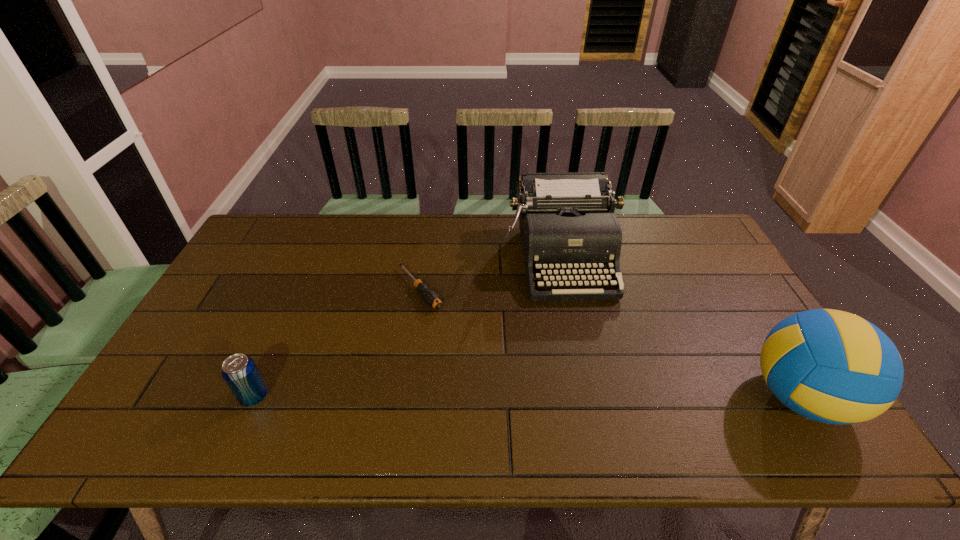
The height and width of the screenshot is (540, 960). In order to click on free point located at the tip of the second object from left to right in this screenshot , I will do `click(473, 353)`.

At what (x,y) coordinates should I click in order to perform the action: click on free space located 0.330m at the tip of the second object from left to right. Please return your answer as a coordinate pair (x, y). Looking at the image, I should click on (501, 384).

Locate an element on the screen. The width and height of the screenshot is (960, 540). vacant space located 0.190m on the front-facing side of the typewriter is located at coordinates (586, 355).

Find the location of a particular element. free space located on the front-facing side of the typewriter is located at coordinates (577, 324).

Find the location of a particular element. The height and width of the screenshot is (540, 960). free space located 0.110m on the front-facing side of the typewriter is located at coordinates (580, 332).

Where is `object that is at the far edge`? This screenshot has width=960, height=540. object that is at the far edge is located at coordinates (568, 228).

What are the coordinates of `beer can positioned at the near edge` in the screenshot? It's located at (239, 371).

Where is `volleyball that is positioned at the near edge`? The height and width of the screenshot is (540, 960). volleyball that is positioned at the near edge is located at coordinates (830, 366).

Locate an element on the screen. This screenshot has height=540, width=960. object that is at the right edge is located at coordinates (830, 366).

Locate an element on the screen. The image size is (960, 540). object at the near right corner is located at coordinates (830, 366).